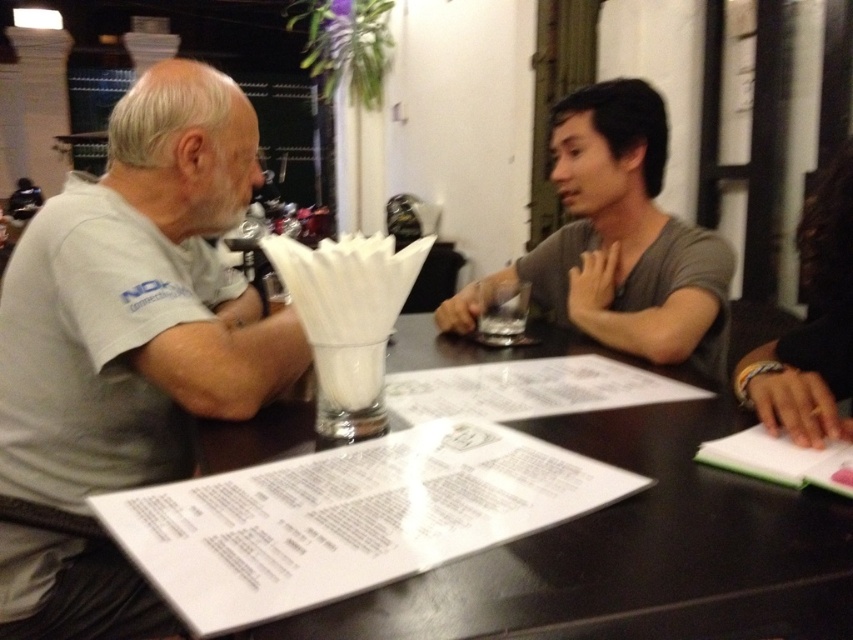
Does gray cotton shirt at left have a smaller size compared to white paper menu at center?

Actually, gray cotton shirt at left might be larger than white paper menu at center.

Can you confirm if gray cotton shirt at left is positioned below white paper menu at center?

No, gray cotton shirt at left is not below white paper menu at center.

Is point (115, 593) farther from viewer compared to point (467, 372)?

No, (115, 593) is closer to viewer.

I want to click on gray cotton shirt at left, so click(x=138, y=300).

Does point (180, 236) come in front of point (672, 344)?

Yes, it is in front of point (672, 344).

Is point (96, 598) more distant than point (693, 276)?

No, (96, 598) is in front of (693, 276).

Does point (47, 337) lie in front of point (624, 216)?

Yes, it is in front of point (624, 216).

Locate an element on the screen. gray cotton shirt at left is located at coordinates (138, 300).

Is point (701, 230) less distant than point (422, 397)?

No, it is not.

Is gray matte shirt at center bigger than white paper menu at center?

Indeed, gray matte shirt at center has a larger size compared to white paper menu at center.

Does point (697, 358) come in front of point (666, 384)?

No, (697, 358) is further to viewer.

Find the location of a particular element. The width and height of the screenshot is (853, 640). gray matte shirt at center is located at coordinates (618, 241).